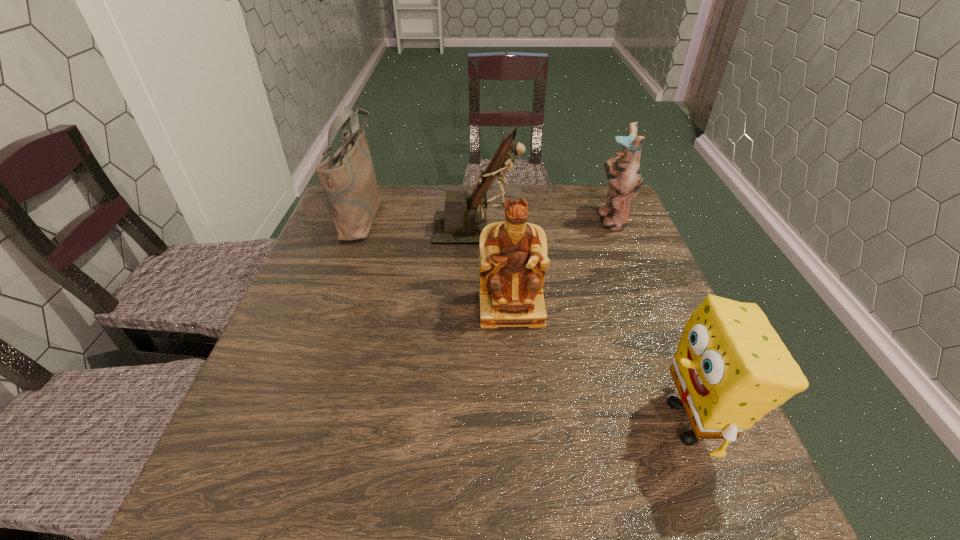
Identify the location of the leftmost object. Image resolution: width=960 pixels, height=540 pixels. (347, 178).

Identify the location of the rightmost figurine. The image size is (960, 540). (623, 172).

Locate an element on the screen. the fourth farthest object is located at coordinates (513, 259).

Find the location of a particular element. Image resolution: width=960 pixels, height=540 pixels. sponge is located at coordinates (731, 368).

Find the location of a particular element. free region located 0.170m on the front-facing side of the shoulder bag is located at coordinates (440, 215).

Image resolution: width=960 pixels, height=540 pixels. In order to click on vacant position located on the front-facing side of the rightmost figurine in this screenshot , I will do `click(545, 219)`.

Where is `free space located 0.100m on the front-facing side of the rightmost figurine`? The width and height of the screenshot is (960, 540). free space located 0.100m on the front-facing side of the rightmost figurine is located at coordinates (563, 219).

Find the location of a particular element. The image size is (960, 540). vacant space located on the front-facing side of the rightmost figurine is located at coordinates click(563, 219).

You are a GUI agent. You are given a task and a screenshot of the screen. Output one action in this format:
    pyautogui.click(x=<x>, y=<y>)
    Task: Click on the vacant area situated 0.280m on the front-facing side of the nearest figurine
    The image size is (960, 540).
    Given the screenshot: What is the action you would take?
    pyautogui.click(x=522, y=450)

Image resolution: width=960 pixels, height=540 pixels. Identify the location of free space located on the face of the nearest object. (509, 422).